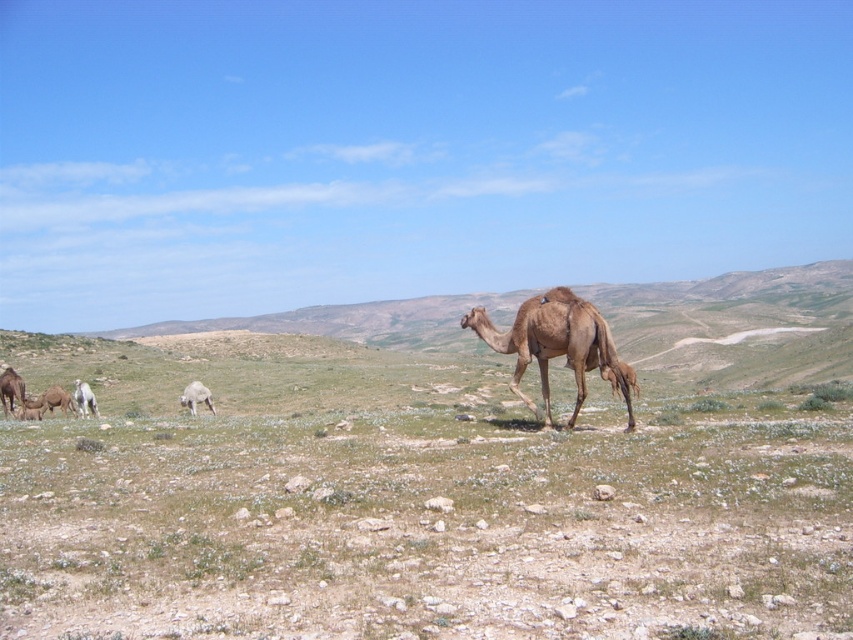
Question: Which of the following is the farthest from the observer?

Choices:
 (A) (193, 387)
 (B) (552, 296)
 (C) (79, 381)

Answer: (C)

Question: Can you confirm if white woolly sheep at lower left is positioned to the right of light brown camel at lower left?

Choices:
 (A) no
 (B) yes

Answer: (B)

Question: Does brown matte camel at center appear on the left side of white woolly sheep at lower left?

Choices:
 (A) no
 (B) yes

Answer: (A)

Question: Does white woolly sheep at lower left appear on the right side of light brown camel at lower left?

Choices:
 (A) no
 (B) yes

Answer: (B)

Question: Which point is closer to the camera?

Choices:
 (A) brown matte camel at center
 (B) light brown camel at lower left

Answer: (A)

Question: Which of the following is the closest to the observer?

Choices:
 (A) (209, 392)
 (B) (575, 316)
 (C) (86, 396)

Answer: (B)